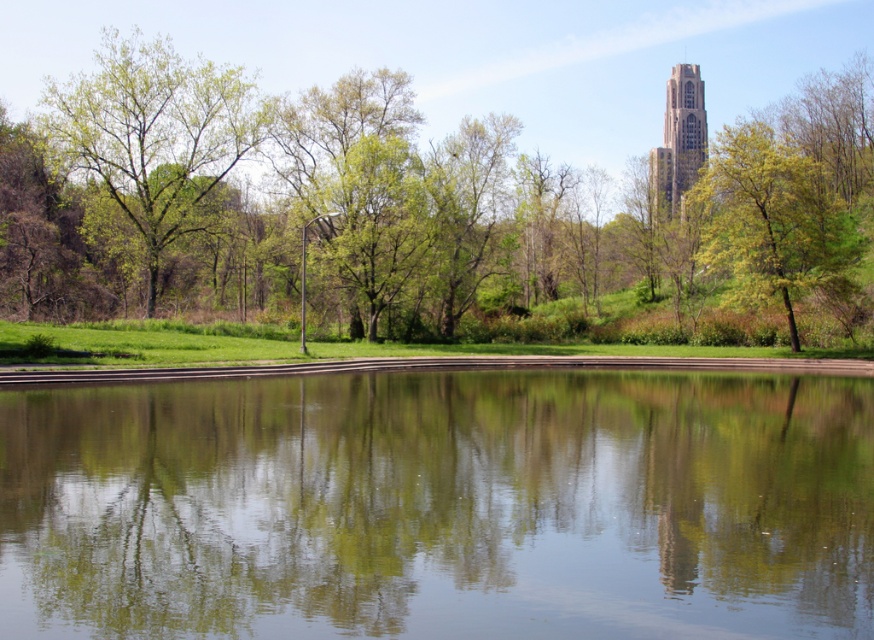
Does green leafy tree at upper center appear on the right side of green leafy tree at upper right?

No, green leafy tree at upper center is not to the right of green leafy tree at upper right.

Is point (549, 298) farther from viewer compared to point (722, 237)?

Yes, it is.

The image size is (874, 640). In order to click on green leafy tree at upper center in this screenshot , I will do 389,205.

Is green leafy tree at upper center to the right of light brown stone tower at upper right from the viewer's perspective?

Incorrect, green leafy tree at upper center is not on the right side of light brown stone tower at upper right.

Does green leafy tree at upper center appear over light brown stone tower at upper right?

Yes.

Identify the location of green leafy tree at upper center. (389, 205).

Identify the location of green leafy tree at upper center. The width and height of the screenshot is (874, 640). (389, 205).

Is green leafy tree at left bigger than green leafy tree at upper right?

Yes, green leafy tree at left is bigger than green leafy tree at upper right.

Based on the photo, can you confirm if green leafy tree at left is shorter than green leafy tree at upper right?

Incorrect, green leafy tree at left's height does not fall short of green leafy tree at upper right's.

Locate an element on the screen. The height and width of the screenshot is (640, 874). green leafy tree at left is located at coordinates (155, 132).